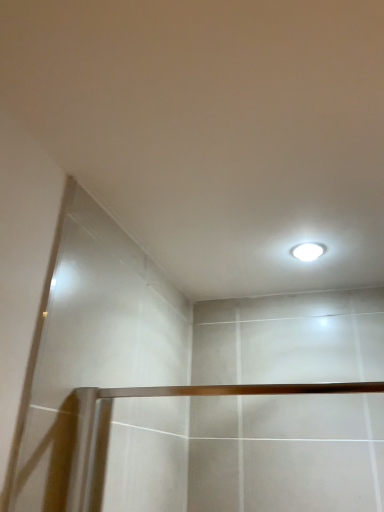
Where is `white glossy droplight at upper center`? white glossy droplight at upper center is located at coordinates (308, 251).

This screenshot has width=384, height=512. What do you see at coordinates (308, 251) in the screenshot?
I see `white glossy droplight at upper center` at bounding box center [308, 251].

You are a GUI agent. You are given a task and a screenshot of the screen. Output one action in this format:
    pyautogui.click(x=<x>, y=<y>)
    Task: Click on the white glossy droplight at upper center
    This screenshot has height=512, width=384.
    Given the screenshot: What is the action you would take?
    pyautogui.click(x=308, y=251)